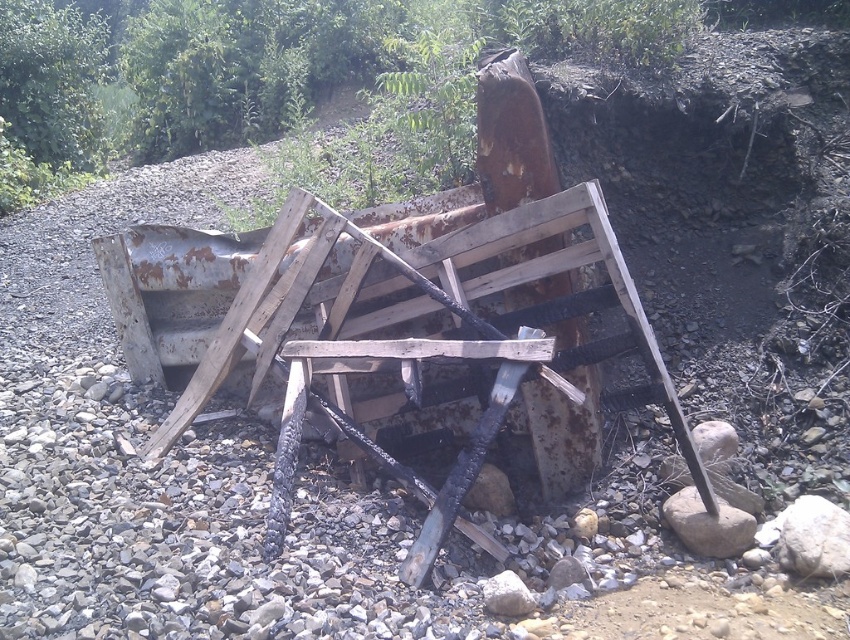
Question: Can you confirm if rusty metal stone at center is positioned above smooth gray rock at center?

Choices:
 (A) yes
 (B) no

Answer: (A)

Question: Among these objects, which one is nearest to the camera?

Choices:
 (A) smooth gray rock at center
 (B) rusty metal stone at center
 (C) white smooth rock at lower right

Answer: (A)

Question: Which point is closer to the camera?

Choices:
 (A) white smooth rock at lower right
 (B) smooth gray rock at center
 (C) rusty metal stone at center

Answer: (B)

Question: Can you confirm if white smooth rock at lower right is bigger than smooth gray rock at center?

Choices:
 (A) no
 (B) yes

Answer: (B)

Question: Can you confirm if white smooth rock at lower right is positioned above smooth gray rock at center?

Choices:
 (A) yes
 (B) no

Answer: (A)

Question: Which object is closer to the camera taking this photo?

Choices:
 (A) rusty metal stone at center
 (B) smooth gray rock at center
 (C) white smooth rock at lower right

Answer: (B)